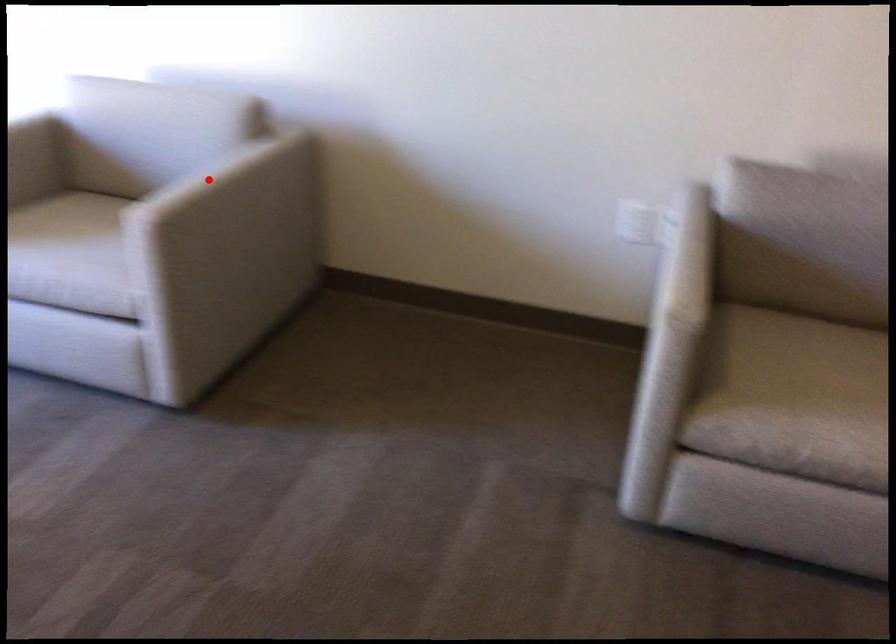
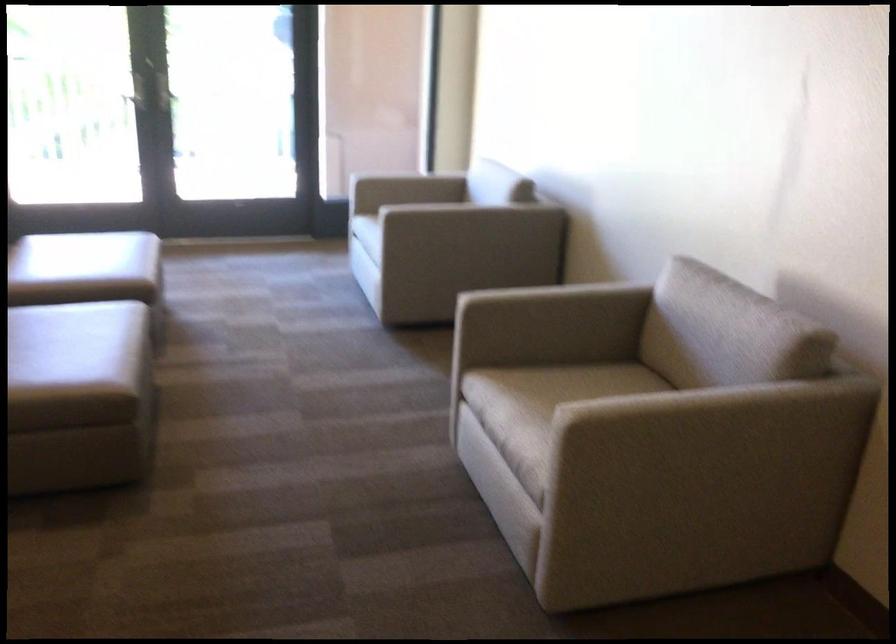
Question: I am providing you with two images of the same scene from different viewpoints. Given a red point in image1, look at the same physical point in image2. Is it:

Choices:
 (A) Closer to the viewpoint
 (B) Farther from the viewpoint

Answer: (B)